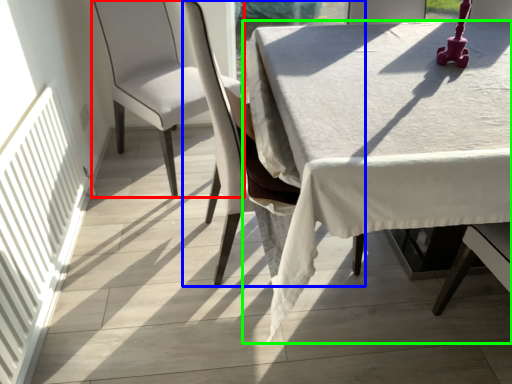
Question: Based on their relative distances, which object is nearer to chair (highlighted by a red box)? Choose from chair (highlighted by a blue box) and table (highlighted by a green box).

Choices:
 (A) chair
 (B) table

Answer: (A)